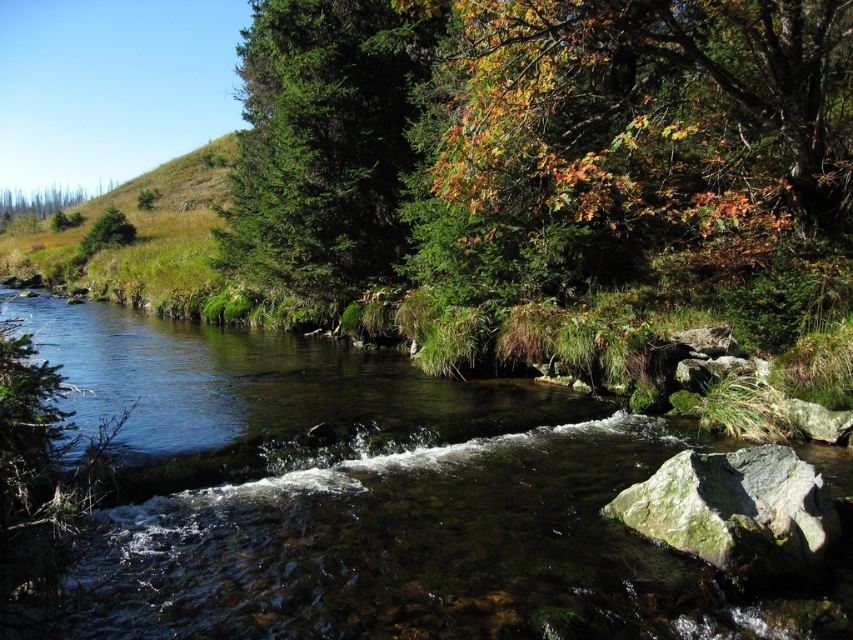
You are standing at the edge of the stream and notice a specific point marked at coordinates point (x=364, y=497). Based on the scene description, where exactly is this point located in relation to the clear water at center?

The point (x=364, y=497) is located on the clear water at center.

You are standing in the forest scene and want to cross the stream. The clear water at center is the main part of the stream. If your walking stick is 2 meters long, can you safely step across the stream using the stick as a bridge between the banks?

The distance between you and the clear water at center is 3.97 meters. Since your walking stick is only 2 meters long, it would not be long enough to span the 3.97 meters required to safely cross the stream as a bridge.